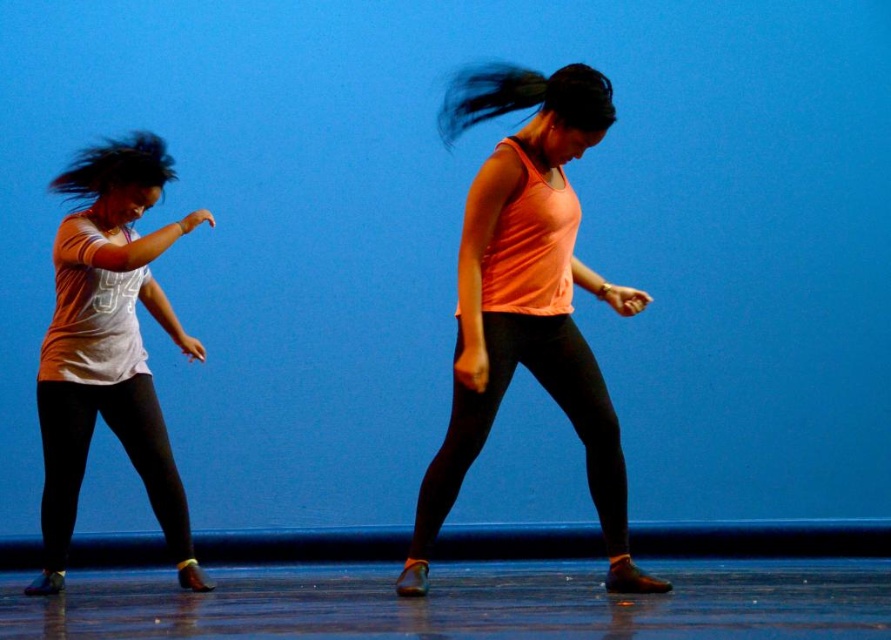
Question: Is orange matte tank top at center below black matte leggings at center?

Choices:
 (A) yes
 (B) no

Answer: (B)

Question: Is orange matte tank top at center bigger than black leggings at left?

Choices:
 (A) no
 (B) yes

Answer: (B)

Question: Which point appears farthest from the camera in this image?

Choices:
 (A) (616, 442)
 (B) (556, 70)
 (C) (42, 419)

Answer: (C)

Question: Which is nearer to the white matte shirt at left?

Choices:
 (A) black shiny hair at left
 (B) orange matte tank top at center
 (C) black leggings at left
 (D) black silky hair at center

Answer: (C)

Question: Does black matte leggings at center appear under black shiny hair at left?

Choices:
 (A) yes
 (B) no

Answer: (A)

Question: Which object is farther from the camera taking this photo?

Choices:
 (A) black matte leggings at center
 (B) white matte shirt at left
 (C) black silky hair at center

Answer: (B)